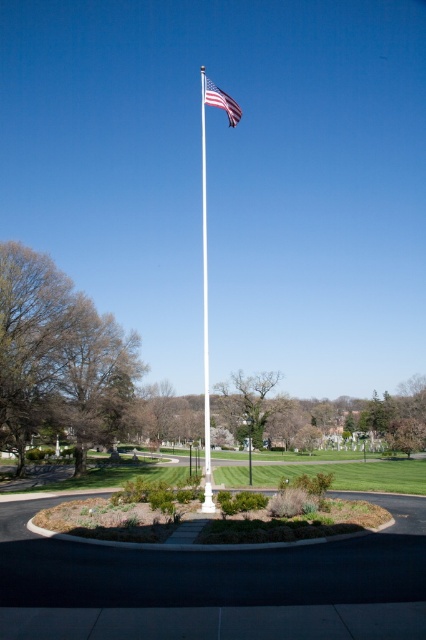
You are a landscape architect designing a new park layout. You need to place a new bench so that it faces the american flag at center but remains visible from the green grass at center. Based on the scene description, where should you position the bench relative to these two elements?

The american flag at center is behind green grass at center, so positioning the bench in front of the green grass at center would allow it to face the american flag at center while remaining visible from the green grass area.